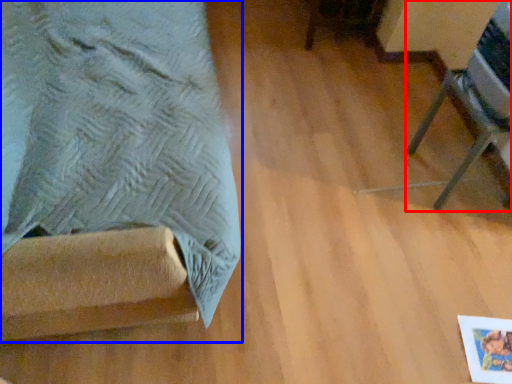
Question: Among these objects, which one is nearest to the camera, furniture (highlighted by a red box) or furniture (highlighted by a blue box)?

Choices:
 (A) furniture
 (B) furniture

Answer: (B)